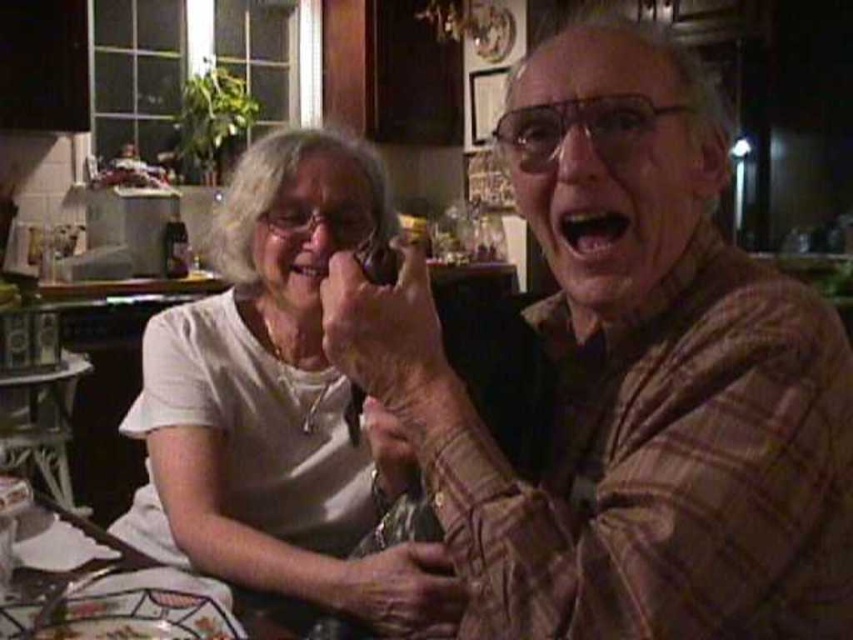
Who is lower down, brown plaid shirt at center or decorative ceramic platter at lower left?

decorative ceramic platter at lower left

Does point (695, 564) come closer to viewer compared to point (64, 611)?

That is True.

Find the location of `brown plaid shirt at center`. brown plaid shirt at center is located at coordinates (627, 380).

Can you confirm if white glossy plate at lower left is positioned below decorative ceramic platter at lower left?

No, white glossy plate at lower left is not below decorative ceramic platter at lower left.

Who is shorter, white glossy plate at lower left or decorative ceramic platter at lower left?

With less height is decorative ceramic platter at lower left.

Who is more forward, (15, 589) or (213, 600)?

Point (213, 600) is more forward.

Locate an element on the screen. The width and height of the screenshot is (853, 640). white glossy plate at lower left is located at coordinates (99, 593).

Is brown plaid shirt at center in front of white matte shirt at upper left?

Yes, brown plaid shirt at center is in front of white matte shirt at upper left.

Does brown plaid shirt at center lie behind white matte shirt at upper left?

No, it is in front of white matte shirt at upper left.

What do you see at coordinates (627, 380) in the screenshot? This screenshot has height=640, width=853. I see `brown plaid shirt at center` at bounding box center [627, 380].

This screenshot has width=853, height=640. Identify the location of brown plaid shirt at center. (627, 380).